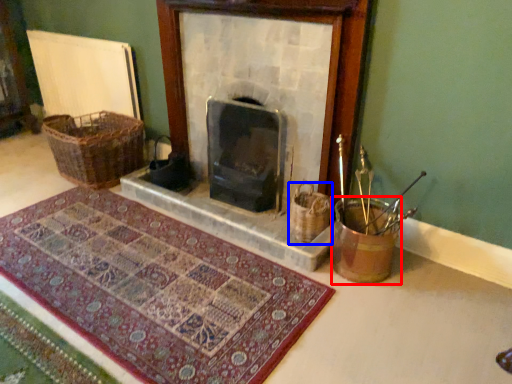
Question: Which point is closer to the camera, basket container (highlighted by a red box) or basket (highlighted by a blue box)?

Choices:
 (A) basket container
 (B) basket

Answer: (A)